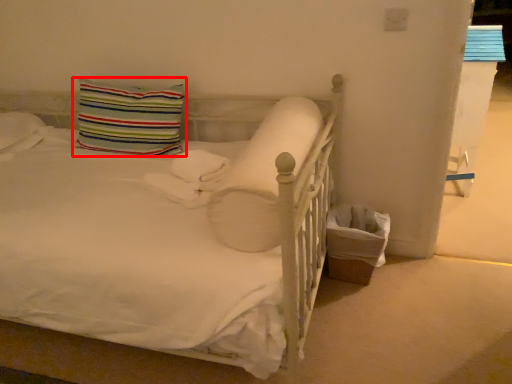
Question: Considering the relative positions of pillow (annotated by the red box) and pillow in the image provided, where is pillow (annotated by the red box) located with respect to the staircase?

Choices:
 (A) left
 (B) right

Answer: (A)